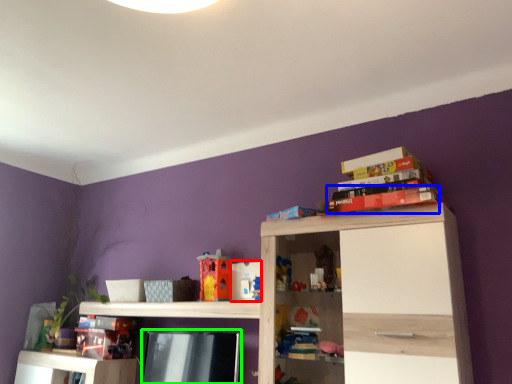
Question: Considering the real-world distances, which object is farthest from toy (highlighted by a red box)? book (highlighted by a blue box) or book (highlighted by a green box)?

Choices:
 (A) book
 (B) book

Answer: (A)